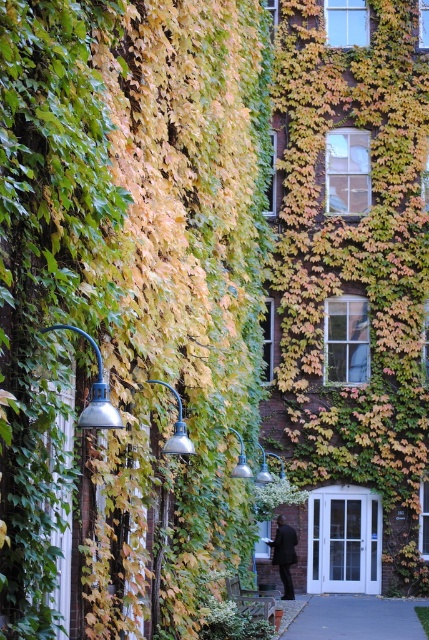
Does point (102, 392) lie behind point (186, 449)?

No, it is in front of (186, 449).

Can you confirm if metallic blue lamp at left is positioned above matte silver lamp at center?

Yes.

The height and width of the screenshot is (640, 429). I want to click on metallic blue lamp at left, so click(x=94, y=392).

Is gray concrete pavement at lower center thinner than matte silver lamp at center?

In fact, gray concrete pavement at lower center might be wider than matte silver lamp at center.

Does gray concrete pavement at lower center appear under matte silver lamp at center?

Indeed, gray concrete pavement at lower center is positioned under matte silver lamp at center.

Which is in front, point (352, 636) or point (178, 419)?

Point (178, 419) is more forward.

The image size is (429, 640). In order to click on gray concrete pavement at lower center in this screenshot , I will do `click(356, 618)`.

Is gray concrete pavement at lower center wider than metallic blue lamp at left?

Yes.

What do you see at coordinates (356, 618) in the screenshot?
I see `gray concrete pavement at lower center` at bounding box center [356, 618].

Find the location of a particular element. gray concrete pavement at lower center is located at coordinates (356, 618).